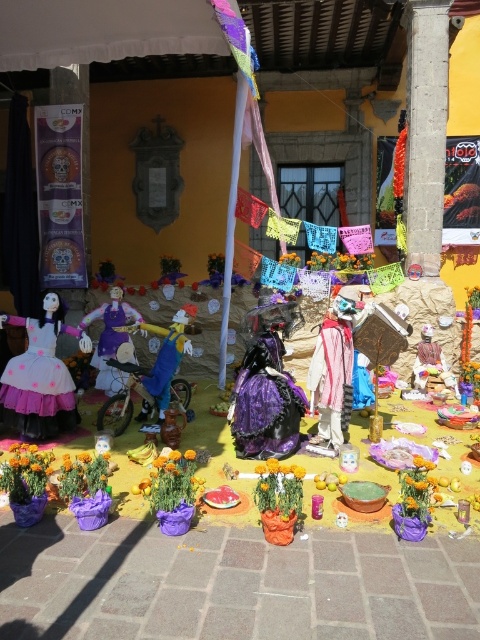
Looking at this image, is matte pink fabric doll at center closer to the viewer compared to vibrant orange petals at center?

No, it is not.

Which is more to the right, matte pink fabric doll at center or vibrant orange petals at center?

Positioned to the right is vibrant orange petals at center.

Find the location of a particular element. This screenshot has height=640, width=480. matte pink fabric doll at center is located at coordinates pyautogui.click(x=40, y=376).

Which is more to the right, matte pink fabric doll at center or orange matte flower at lower center?

Positioned to the right is orange matte flower at lower center.

Can you confirm if matte pink fabric doll at center is positioned to the left of orange matte flower at lower center?

Yes, matte pink fabric doll at center is to the left of orange matte flower at lower center.

The height and width of the screenshot is (640, 480). I want to click on matte pink fabric doll at center, so click(x=40, y=376).

Identify the location of matte pink fabric doll at center. This screenshot has width=480, height=640. (40, 376).

Does vibrant orange petals at center have a lesser height compared to orange matte flower at lower center?

No.

Between vibrant orange petals at center and orange matte flower at lower center, which one appears on the left side from the viewer's perspective?

vibrant orange petals at center

Image resolution: width=480 pixels, height=640 pixels. Describe the element at coordinates (170, 481) in the screenshot. I see `vibrant orange petals at center` at that location.

Image resolution: width=480 pixels, height=640 pixels. I want to click on vibrant orange petals at center, so click(x=170, y=481).